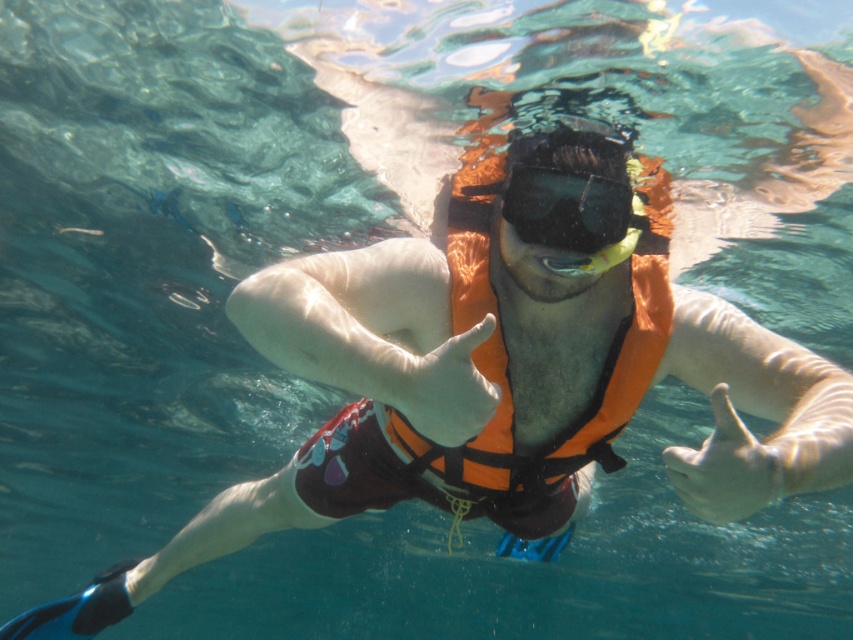
Question: Considering the relative positions of orange fabric life jacket at center and black matte snorkel mask at center in the image provided, where is orange fabric life jacket at center located with respect to black matte snorkel mask at center?

Choices:
 (A) below
 (B) above

Answer: (A)

Question: Is orange fabric life jacket at center positioned in front of black matte snorkel mask at center?

Choices:
 (A) no
 (B) yes

Answer: (B)

Question: Does orange fabric life jacket at center appear over black matte snorkel mask at center?

Choices:
 (A) no
 (B) yes

Answer: (A)

Question: Which of the following is the farthest from the observer?

Choices:
 (A) (473, 244)
 (B) (560, 216)

Answer: (A)

Question: Which point is farther to the camera?

Choices:
 (A) orange fabric life jacket at center
 (B) black matte snorkel mask at center

Answer: (B)

Question: Among these points, which one is farthest from the camera?

Choices:
 (A) (566, 173)
 (B) (567, 474)

Answer: (B)